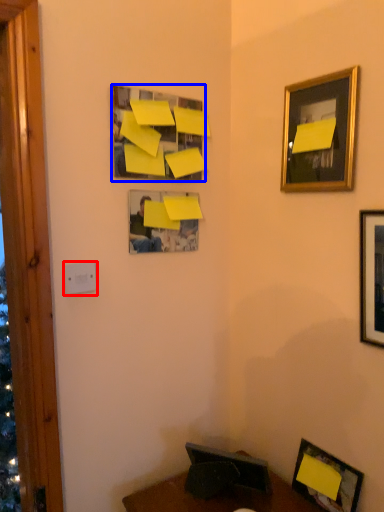
Question: Among these objects, which one is nearest to the camera, light switch (highlighted by a red box) or picture frame (highlighted by a blue box)?

Choices:
 (A) light switch
 (B) picture frame

Answer: (A)